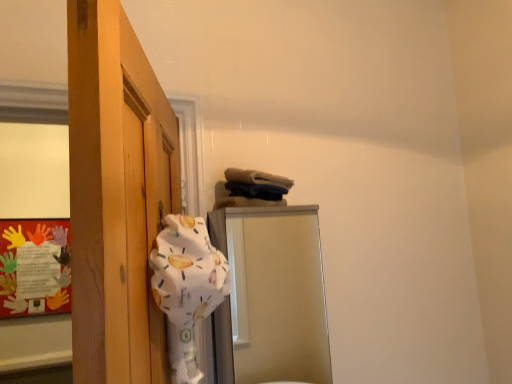
Question: Is multicolored paper at left looking in the opposite direction of metallic silver mirror at center?

Choices:
 (A) no
 (B) yes

Answer: (A)

Question: Can you confirm if multicolored paper at left is taller than metallic silver mirror at center?

Choices:
 (A) no
 (B) yes

Answer: (A)

Question: Is multicolored paper at left not within metallic silver mirror at center?

Choices:
 (A) no
 (B) yes

Answer: (B)

Question: Does multicolored paper at left have a lesser height compared to metallic silver mirror at center?

Choices:
 (A) yes
 (B) no

Answer: (A)

Question: Is multicolored paper at left placed right next to metallic silver mirror at center?

Choices:
 (A) no
 (B) yes

Answer: (A)

Question: In the image, is metallic silver mirror at center on the left side or the right side of white fabric at left?

Choices:
 (A) left
 (B) right

Answer: (B)

Question: From the image's perspective, is metallic silver mirror at center located above or below white fabric at left?

Choices:
 (A) below
 (B) above

Answer: (A)

Question: Looking at their shapes, would you say metallic silver mirror at center is wider or thinner than white fabric at left?

Choices:
 (A) thin
 (B) wide

Answer: (B)

Question: Is point (279, 241) closer or farther from the camera than point (173, 238)?

Choices:
 (A) farther
 (B) closer

Answer: (A)

Question: Is point (161, 281) closer or farther from the camera than point (66, 309)?

Choices:
 (A) closer
 (B) farther

Answer: (A)

Question: Considering the positions of white fabric at left and multicolored paper at left in the image, is white fabric at left taller or shorter than multicolored paper at left?

Choices:
 (A) tall
 (B) short

Answer: (B)

Question: Considering the positions of white fabric at left and multicolored paper at left in the image, is white fabric at left bigger or smaller than multicolored paper at left?

Choices:
 (A) small
 (B) big

Answer: (B)

Question: Is white fabric at left in front of or behind multicolored paper at left in the image?

Choices:
 (A) behind
 (B) front

Answer: (B)

Question: In terms of size, does white fabric at left appear bigger or smaller than metallic silver mirror at center?

Choices:
 (A) small
 (B) big

Answer: (A)

Question: Relative to metallic silver mirror at center, is white fabric at left in front or behind?

Choices:
 (A) front
 (B) behind

Answer: (A)